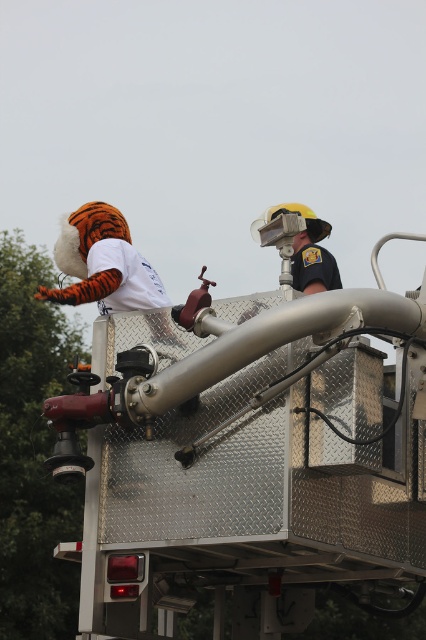
Does orange plush tiger at upper left have a lesser width compared to matte black helmet at upper center?

In fact, orange plush tiger at upper left might be wider than matte black helmet at upper center.

Where is `orange plush tiger at upper left`? The width and height of the screenshot is (426, 640). orange plush tiger at upper left is located at coordinates (109, 269).